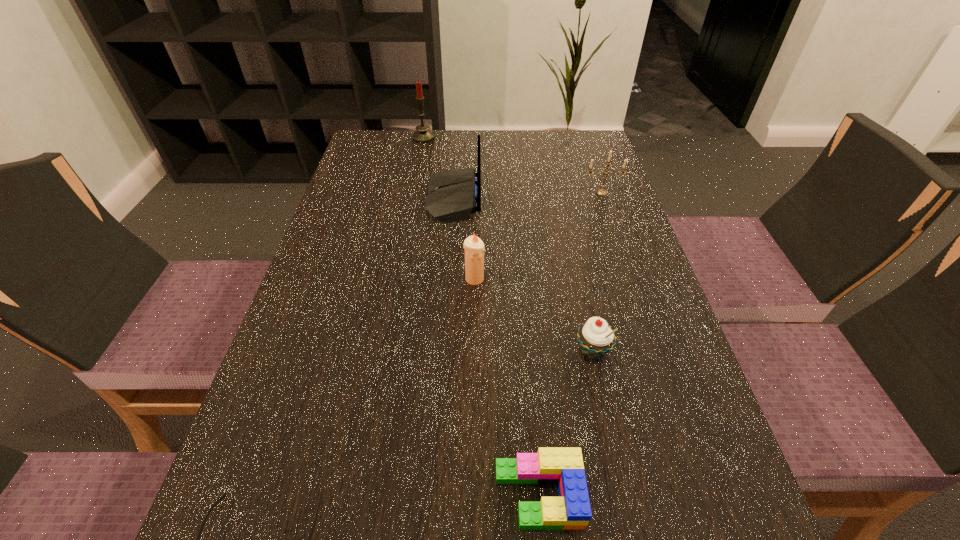
Identify the location of vacant space that's between the third nearest object and the farthest candle. Image resolution: width=960 pixels, height=540 pixels. (508, 244).

Where is `vacant region between the router and the third shortest object`? The width and height of the screenshot is (960, 540). vacant region between the router and the third shortest object is located at coordinates (523, 275).

Find the location of a particular element. The image size is (960, 540). unoccupied area between the rightmost candle and the fifth object from left to right is located at coordinates (570, 344).

Locate an element on the screen. The image size is (960, 540). object that ranks as the third closest to the leftmost candle is located at coordinates (474, 247).

The height and width of the screenshot is (540, 960). Find the location of `object that is the third nearest to the second farthest candle`. object that is the third nearest to the second farthest candle is located at coordinates (596, 338).

Where is `the closest candle relative to the third object from right to left`? The width and height of the screenshot is (960, 540). the closest candle relative to the third object from right to left is located at coordinates (474, 247).

Choose which candle is the second nearest neighbor to the cupcake. Please provide its 2D coordinates. Your answer should be formatted as a tuple, i.e. [(x, y)], where the tuple contains the x and y coordinates of a point satisfying the conditions above.

[(602, 192)]

Where is `vacant area that satisfies the following two spatial constraints: 1. on the back of the router; 2. on the left side of the second candle from left to right`? The image size is (960, 540). vacant area that satisfies the following two spatial constraints: 1. on the back of the router; 2. on the left side of the second candle from left to right is located at coordinates (448, 279).

Locate an element on the screen. free space in the image that satisfies the following two spatial constraints: 1. on the back of the router; 2. on the right side of the cupcake is located at coordinates (443, 351).

The height and width of the screenshot is (540, 960). In order to click on blank space that satisfies the following two spatial constraints: 1. on the front side of the second candle from right to left; 2. on the right side of the Lego in this screenshot , I will do `click(471, 495)`.